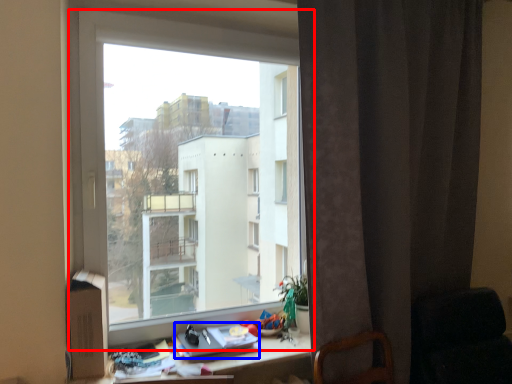
Question: Which object appears farthest to the camera in this image, window (highlighted by a red box) or book (highlighted by a blue box)?

Choices:
 (A) window
 (B) book

Answer: (B)